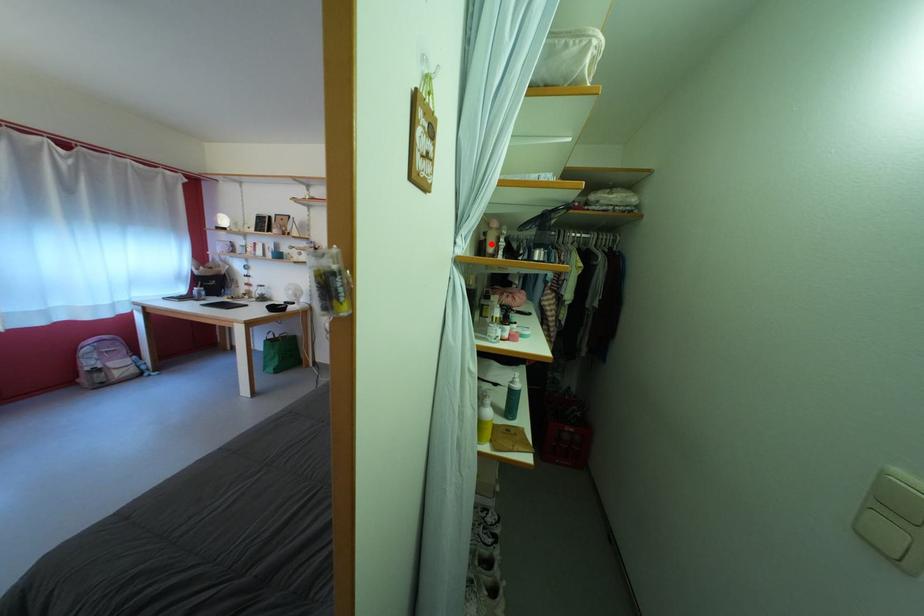
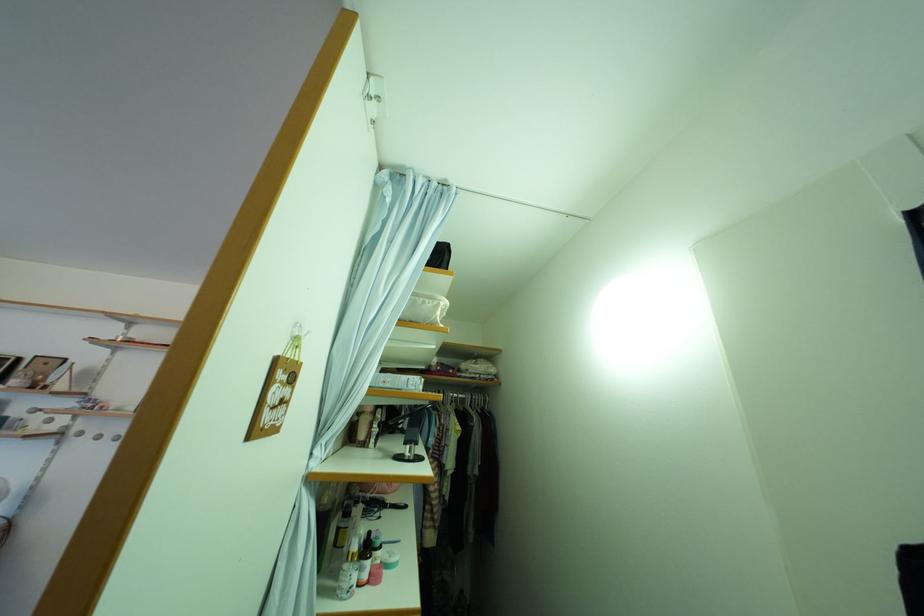
Question: I am providing you with two images of the same scene from different viewpoints. A red point is marked on the first image. Can you still see the location of the red point in image 2?

Choices:
 (A) Yes
 (B) No

Answer: (A)